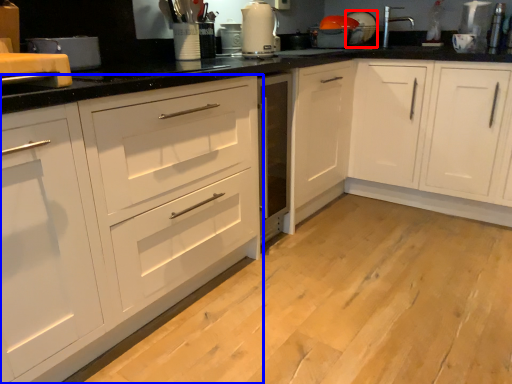
Question: Which of the following is the farthest to the observer, appliance (highlighted by a red box) or cabinetry (highlighted by a blue box)?

Choices:
 (A) appliance
 (B) cabinetry

Answer: (A)